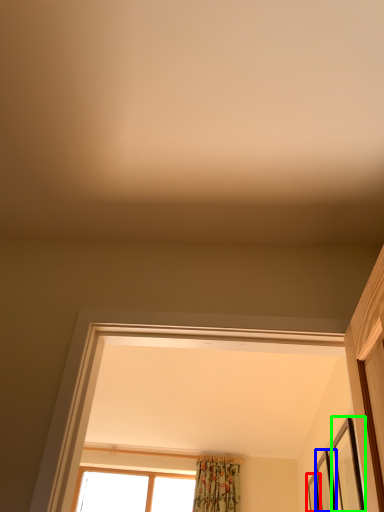
Question: Which is nearer to the picture frame (highlighted by a red box)? picture frame (highlighted by a blue box) or picture frame (highlighted by a green box).

Choices:
 (A) picture frame
 (B) picture frame

Answer: (A)